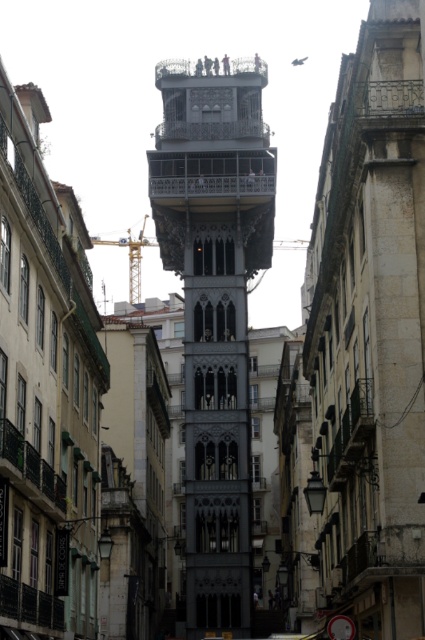
Which is more to the left, gray stone bell tower at center or yellow metallic crane at center?

yellow metallic crane at center

Can you confirm if gray stone bell tower at center is positioned below yellow metallic crane at center?

Correct, gray stone bell tower at center is located below yellow metallic crane at center.

Measure the distance between gray stone bell tower at center and camera.

They are 130.60 meters apart.

The image size is (425, 640). Identify the location of gray stone bell tower at center. (x=215, y=310).